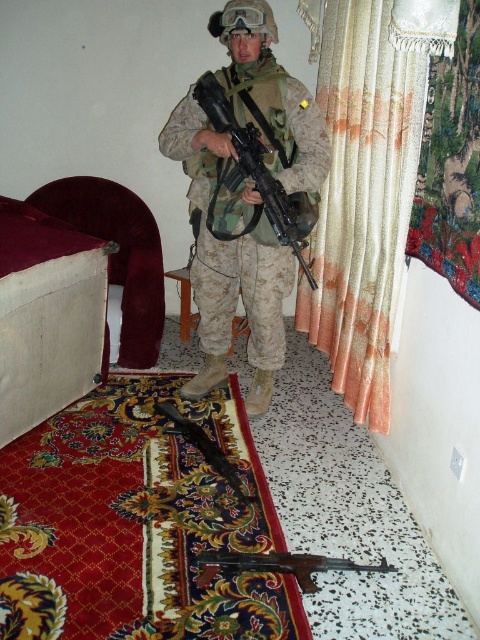
Question: Among these objects, which one is farthest from the camera?

Choices:
 (A) matte black rifle at center
 (B) black plastic rifle at center
 (C) camouflage fabric uniform at center

Answer: (C)

Question: Which object is positioned closest to the camouflage fabric uniform at center?

Choices:
 (A) matte black rifle at center
 (B) beige/textured curtain at right
 (C) black plastic rifle at center

Answer: (B)

Question: Does camouflage fabric uniform at center appear over black plastic rifle at center?

Choices:
 (A) no
 (B) yes

Answer: (B)

Question: Which of the following is the farthest from the observer?

Choices:
 (A) camouflage fabric uniform at center
 (B) beige/textured curtain at right
 (C) black plastic rifle at center

Answer: (A)

Question: Does black plastic rifle at center have a larger size compared to matte black rifle at center?

Choices:
 (A) no
 (B) yes

Answer: (A)

Question: Where is camouflage fabric uniform at center located in relation to black plastic rifle at center in the image?

Choices:
 (A) left
 (B) right

Answer: (A)